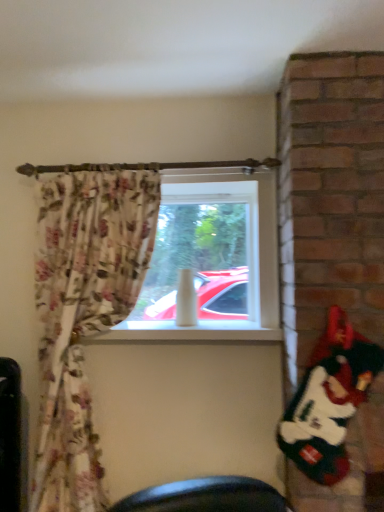
The width and height of the screenshot is (384, 512). What do you see at coordinates (202, 251) in the screenshot?
I see `transparent glass window at center` at bounding box center [202, 251].

Where is `transparent glass window at center`? The height and width of the screenshot is (512, 384). transparent glass window at center is located at coordinates (202, 251).

This screenshot has height=512, width=384. What do you see at coordinates (329, 400) in the screenshot?
I see `white plush santa at right` at bounding box center [329, 400].

Measure the distance between point (373, 374) and camera.

Point (373, 374) is 4.77 feet from camera.

The height and width of the screenshot is (512, 384). Find the location of `white plush santa at right`. white plush santa at right is located at coordinates (329, 400).

Where is `transparent glass window at center`? This screenshot has height=512, width=384. transparent glass window at center is located at coordinates (202, 251).

Would you say transparent glass window at center is to the left or to the right of white plush santa at right in the picture?

transparent glass window at center is to the left of white plush santa at right.

Which object is more forward, transparent glass window at center or white plush santa at right?

Positioned in front is white plush santa at right.

Is point (212, 290) positioned after point (303, 417)?

Yes.

From the image's perspective, is transparent glass window at center located beneath white plush santa at right?

No.

From a real-world perspective, is transparent glass window at center positioned under white plush santa at right based on gravity?

Actually, transparent glass window at center is physically above white plush santa at right in the real world.

Which of these two, transparent glass window at center or white plush santa at right, is thinner?

white plush santa at right is thinner.

Consider the image. Considering the sizes of objects transparent glass window at center and white plush santa at right in the image provided, who is shorter, transparent glass window at center or white plush santa at right?

white plush santa at right is shorter.

Is transparent glass window at center smaller than white plush santa at right?

No, transparent glass window at center is not smaller than white plush santa at right.

Choose the correct answer: Is transparent glass window at center inside white plush santa at right or outside it?

transparent glass window at center is located beyond the bounds of white plush santa at right.

Are transparent glass window at center and white plush santa at right far apart?

transparent glass window at center is actually quite close to white plush santa at right.

Is white plush santa at right at the back of transparent glass window at center?

transparent glass window at center does not have its back to white plush santa at right.

At what (x,y) coordinates should I click in order to perform the action: click on santa claus lying in front of the transparent glass window at center. Please return your answer as a coordinate pair (x, y). The height and width of the screenshot is (512, 384). Looking at the image, I should click on (329, 400).

Which object is positioned more to the left, white plush santa at right or transparent glass window at center?

transparent glass window at center.

In the scene shown: Is white plush santa at right further to the viewer compared to transparent glass window at center?

No, it is not.

Is point (334, 351) positioned in front of point (250, 236)?

Yes, point (334, 351) is closer to viewer.

From the image's perspective, who appears lower, white plush santa at right or transparent glass window at center?

From the image's view, white plush santa at right is below.

From a real-world perspective, is white plush santa at right located beneath transparent glass window at center?

Yes, from a real-world perspective, white plush santa at right is below transparent glass window at center.

Can you confirm if white plush santa at right is wider than transparent glass window at center?

In fact, white plush santa at right might be narrower than transparent glass window at center.

Which of these two, white plush santa at right or transparent glass window at center, stands shorter?

white plush santa at right is shorter.

Is white plush santa at right smaller than transparent glass window at center?

Indeed, white plush santa at right has a smaller size compared to transparent glass window at center.

Do you think white plush santa at right is within transparent glass window at center, or outside of it?

white plush santa at right lies outside transparent glass window at center.

Is white plush santa at right not near transparent glass window at center?

No, white plush santa at right is not far away from transparent glass window at center.

Could you tell me if white plush santa at right is facing transparent glass window at center?

No.

How much distance is there between white plush santa at right and transparent glass window at center?

A distance of 77.09 centimeters exists between white plush santa at right and transparent glass window at center.

In order to click on window screen behind the white plush santa at right in this screenshot , I will do `click(202, 251)`.

Locate an element on the screen. santa claus located below the transparent glass window at center (from the image's perspective) is located at coordinates (329, 400).

This screenshot has width=384, height=512. I want to click on santa claus below the transparent glass window at center (from a real-world perspective), so click(x=329, y=400).